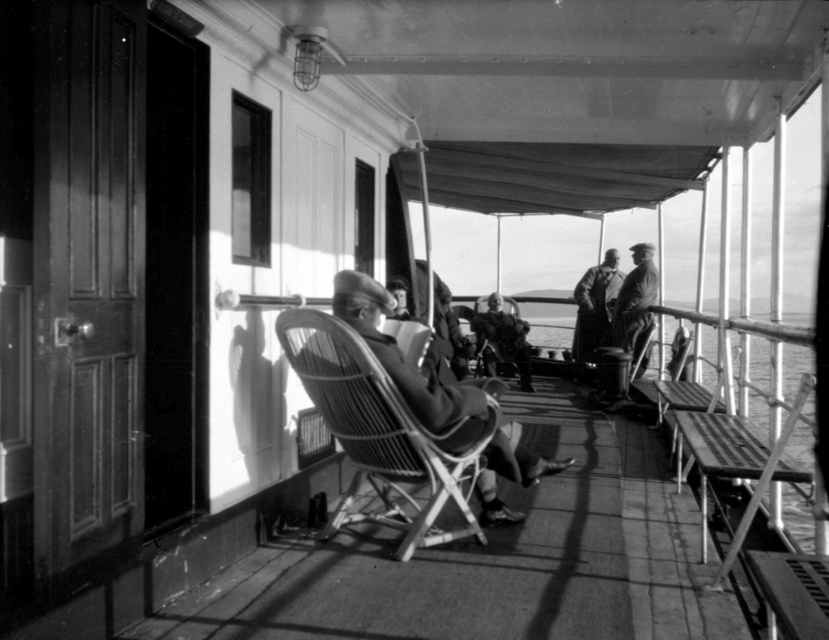
Between point (526, 458) and point (589, 326), which one is positioned behind?

Point (589, 326)

Does smooth leather hat at center have a lesser width compared to coarse wool coat at center?

No, smooth leather hat at center is not thinner than coarse wool coat at center.

Is point (508, 516) in front of point (609, 285)?

That is True.

You are a GUI agent. You are given a task and a screenshot of the screen. Output one action in this format:
    pyautogui.click(x=<x>, y=<y>)
    Task: Click on the smooth leather hat at center
    The width and height of the screenshot is (829, 640).
    Given the screenshot: What is the action you would take?
    pyautogui.click(x=411, y=364)

Consider the image. Can you confirm if woven wood chair at center is positioned to the left of smooth leather hat at center?

Indeed, woven wood chair at center is positioned on the left side of smooth leather hat at center.

Who is positioned more to the right, woven wood chair at center or smooth leather hat at center?

smooth leather hat at center

Does point (388, 451) lie in front of point (536, 481)?

Yes, it is in front of point (536, 481).

Where is `woven wood chair at center`? Image resolution: width=829 pixels, height=640 pixels. woven wood chair at center is located at coordinates (377, 435).

Does woven wood chair at center have a lesser height compared to coarse wool coat at center?

Indeed, woven wood chair at center has a lesser height compared to coarse wool coat at center.

Locate an element on the screen. Image resolution: width=829 pixels, height=640 pixels. woven wood chair at center is located at coordinates (377, 435).

This screenshot has width=829, height=640. I want to click on woven wood chair at center, so click(377, 435).

Find the location of a particular element. woven wood chair at center is located at coordinates (377, 435).